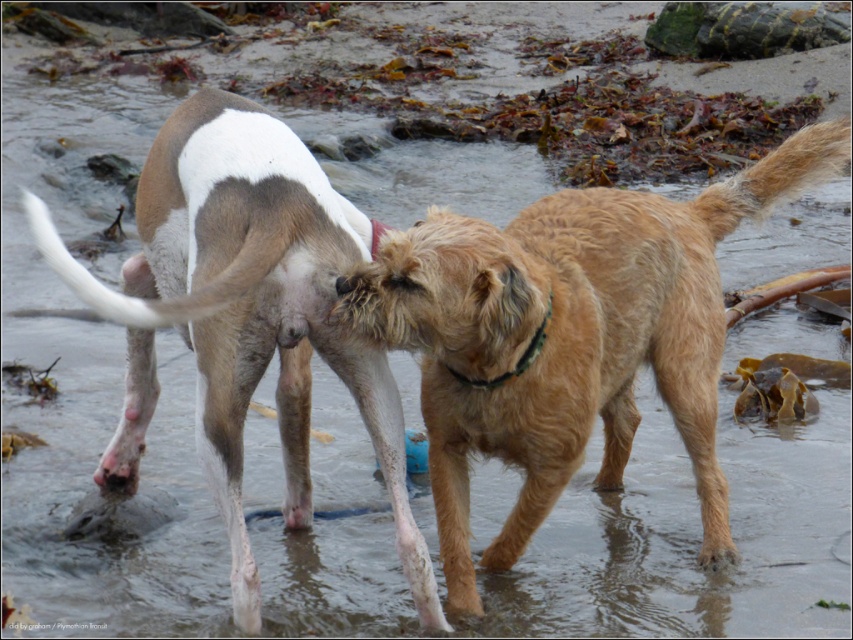
Question: Is golden fur dog at center smaller than brown fur dog at center?

Choices:
 (A) no
 (B) yes

Answer: (A)

Question: Which object appears closest to the camera in this image?

Choices:
 (A) golden fur dog at center
 (B) brown fur dog at center

Answer: (B)

Question: Is golden fur dog at center to the left of brown fur dog at center from the viewer's perspective?

Choices:
 (A) yes
 (B) no

Answer: (B)

Question: Is golden fur dog at center further to camera compared to brown fur dog at center?

Choices:
 (A) no
 (B) yes

Answer: (B)

Question: Which point is closer to the camera taking this photo?

Choices:
 (A) (202, 278)
 (B) (561, 204)

Answer: (A)